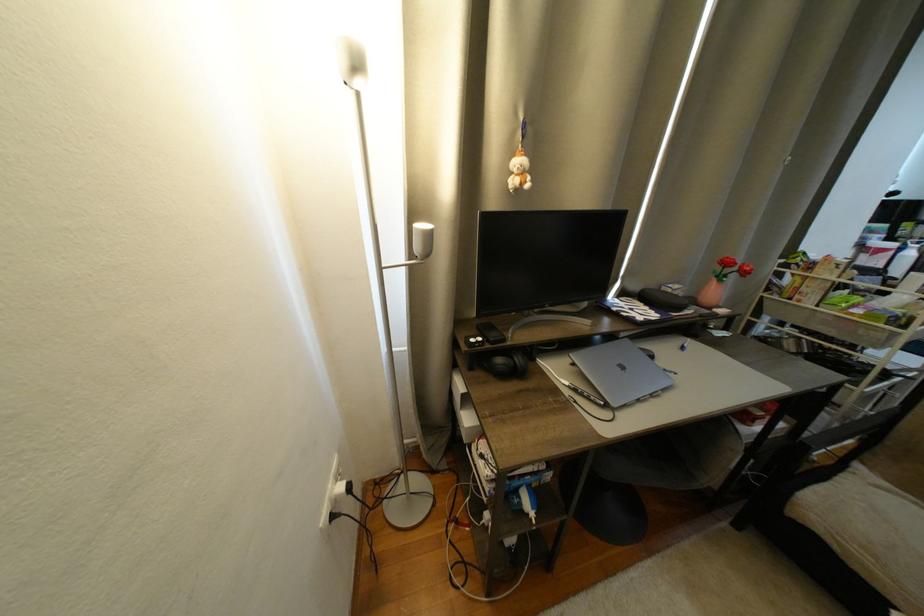
Which object does [505,363] point to?

This point indicates the black headphones.